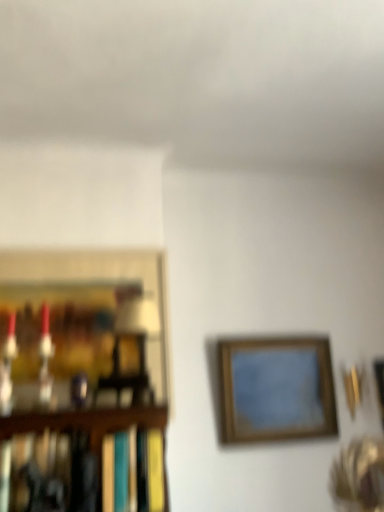
Describe the element at coordinates (81, 374) in the screenshot. I see `wooden picture frame at left, which ranks as the 1th picture frame in left-to-right order` at that location.

The image size is (384, 512). Find the location of `wooden picture frame at left, which is counted as the 3th picture frame, starting from the right`. wooden picture frame at left, which is counted as the 3th picture frame, starting from the right is located at coordinates (81, 374).

Can you confirm if hardcover book at left is taller than wooden picture frame at left, which ranks as the 1th picture frame in left-to-right order?

No, hardcover book at left is not taller than wooden picture frame at left, which ranks as the 1th picture frame in left-to-right order.

Looking at this image, which of these two, hardcover book at left or wooden picture frame at left, which ranks as the 1th picture frame in left-to-right order, is thinner?

wooden picture frame at left, which ranks as the 1th picture frame in left-to-right order, is thinner.

Can wooden picture frame at left, which is counted as the 3th picture frame, starting from the right, be found inside hardcover book at left?

No, hardcover book at left does not contain wooden picture frame at left, which is counted as the 3th picture frame, starting from the right.

Consider the image. Does wooden framed picture at center, which is the second picture frame from right to left, turn towards wooden frame at upper right, the first picture frame when ordered from right to left?

No, wooden framed picture at center, which is the second picture frame from right to left, is not turned towards wooden frame at upper right, the first picture frame when ordered from right to left.

Can you confirm if wooden framed picture at center, which is the second picture frame from right to left, is bigger than wooden frame at upper right, the first picture frame when ordered from right to left?

Correct, wooden framed picture at center, which is the second picture frame from right to left, is larger in size than wooden frame at upper right, the first picture frame when ordered from right to left.

Between wooden framed picture at center, which is the second picture frame from right to left, and wooden frame at upper right, the third picture frame viewed from the left, which one has more height?

Standing taller between the two is wooden framed picture at center, which is the second picture frame from right to left.

Who is more distant, wooden framed picture at center, which appears as the 2th picture frame when viewed from the left, or wooden frame at upper right, the first picture frame when ordered from right to left?

Positioned behind is wooden frame at upper right, the first picture frame when ordered from right to left.

Does wooden picture frame at left, which ranks as the 1th picture frame in left-to-right order, appear on the left side of hardcover book at left?

Yes, wooden picture frame at left, which ranks as the 1th picture frame in left-to-right order, is to the left of hardcover book at left.

Consider the image. Is wooden picture frame at left, which ranks as the 1th picture frame in left-to-right order, beside hardcover book at left?

wooden picture frame at left, which ranks as the 1th picture frame in left-to-right order, and hardcover book at left are not in contact.

Would you say wooden picture frame at left, which ranks as the 1th picture frame in left-to-right order, is outside hardcover book at left?

Absolutely, wooden picture frame at left, which ranks as the 1th picture frame in left-to-right order, is external to hardcover book at left.

Between point (152, 306) and point (23, 466), which one is positioned behind?

Point (152, 306)

Is hardcover book at left aimed at wooden framed picture at center, which appears as the 2th picture frame when viewed from the left?

No, hardcover book at left does not turn towards wooden framed picture at center, which appears as the 2th picture frame when viewed from the left.

Choose the correct answer: Is hardcover book at left inside wooden framed picture at center, which appears as the 2th picture frame when viewed from the left, or outside it?

hardcover book at left is not inside wooden framed picture at center, which appears as the 2th picture frame when viewed from the left, it's outside.

You are a GUI agent. You are given a task and a screenshot of the screen. Output one action in this format:
    pyautogui.click(x=<x>, y=<y>)
    Task: Click on the 1st picture frame counting from the right of the hardcover book at left
    Image resolution: width=384 pixels, height=512 pixels.
    Given the screenshot: What is the action you would take?
    pyautogui.click(x=276, y=389)

Between wooden frame at upper right, the third picture frame viewed from the left, and wooden picture frame at left, which is counted as the 3th picture frame, starting from the right, which one has less height?

With less height is wooden frame at upper right, the third picture frame viewed from the left.

In the image, is wooden frame at upper right, the first picture frame when ordered from right to left, positioned in front of or behind wooden picture frame at left, which ranks as the 1th picture frame in left-to-right order?

wooden frame at upper right, the first picture frame when ordered from right to left, is positioned farther from the viewer than wooden picture frame at left, which ranks as the 1th picture frame in left-to-right order.

From the picture: Is wooden frame at upper right, the first picture frame when ordered from right to left, taller than wooden framed picture at center, which appears as the 2th picture frame when viewed from the left?

No, wooden frame at upper right, the first picture frame when ordered from right to left, is not taller than wooden framed picture at center, which appears as the 2th picture frame when viewed from the left.

Does wooden frame at upper right, the first picture frame when ordered from right to left, have a smaller size compared to wooden framed picture at center, which appears as the 2th picture frame when viewed from the left?

Indeed, wooden frame at upper right, the first picture frame when ordered from right to left, has a smaller size compared to wooden framed picture at center, which appears as the 2th picture frame when viewed from the left.

From the image's perspective, relative to wooden framed picture at center, which appears as the 2th picture frame when viewed from the left, is wooden frame at upper right, the third picture frame viewed from the left, above or below?

wooden frame at upper right, the third picture frame viewed from the left, is situated lower than wooden framed picture at center, which appears as the 2th picture frame when viewed from the left, in the image.

Considering the positions of objects wooden frame at upper right, the first picture frame when ordered from right to left, and wooden framed picture at center, which is the second picture frame from right to left, in the image provided, who is more to the right, wooden frame at upper right, the first picture frame when ordered from right to left, or wooden framed picture at center, which is the second picture frame from right to left,?

wooden frame at upper right, the first picture frame when ordered from right to left, is more to the right.

How much distance is there between wooden picture frame at left, which ranks as the 1th picture frame in left-to-right order, and wooden frame at upper right, the third picture frame viewed from the left?

wooden picture frame at left, which ranks as the 1th picture frame in left-to-right order, and wooden frame at upper right, the third picture frame viewed from the left, are 1.31 meters apart.

Which object is thinner, wooden picture frame at left, which ranks as the 1th picture frame in left-to-right order, or wooden frame at upper right, the third picture frame viewed from the left?

wooden frame at upper right, the third picture frame viewed from the left, is thinner.

From a real-world perspective, is wooden picture frame at left, which is counted as the 3th picture frame, starting from the right, over wooden frame at upper right, the first picture frame when ordered from right to left?

Yes.

Can you confirm if wooden picture frame at left, which ranks as the 1th picture frame in left-to-right order, is positioned to the left of wooden frame at upper right, the first picture frame when ordered from right to left?

Yes, wooden picture frame at left, which ranks as the 1th picture frame in left-to-right order, is to the left of wooden frame at upper right, the first picture frame when ordered from right to left.

Find the location of a particular element. This screenshot has width=384, height=512. book to the right of wooden picture frame at left, which is counted as the 3th picture frame, starting from the right is located at coordinates [x=48, y=472].

Identify the location of the 1st picture frame above when counting from the wooden frame at upper right, the third picture frame viewed from the left (from the image's perspective). The image size is (384, 512). (276, 389).

Looking at the image, which one is located closer to wooden framed picture at center, which appears as the 2th picture frame when viewed from the left, hardcover book at left or wooden frame at upper right, the third picture frame viewed from the left?

wooden frame at upper right, the third picture frame viewed from the left, lies closer to wooden framed picture at center, which appears as the 2th picture frame when viewed from the left, than the other object.

Based on their spatial positions, is wooden frame at upper right, the third picture frame viewed from the left, or wooden picture frame at left, which ranks as the 1th picture frame in left-to-right order, closer to wooden framed picture at center, which appears as the 2th picture frame when viewed from the left?

Among the two, wooden frame at upper right, the third picture frame viewed from the left, is located nearer to wooden framed picture at center, which appears as the 2th picture frame when viewed from the left.

When comparing their distances from hardcover book at left, does wooden frame at upper right, the third picture frame viewed from the left, or wooden framed picture at center, which is the second picture frame from right to left, seem closer?

wooden framed picture at center, which is the second picture frame from right to left.

In the scene shown: From the image, which object appears to be nearer to wooden frame at upper right, the third picture frame viewed from the left, wooden framed picture at center, which is the second picture frame from right to left, or wooden picture frame at left, which is counted as the 3th picture frame, starting from the right?

Based on the image, wooden framed picture at center, which is the second picture frame from right to left, appears to be nearer to wooden frame at upper right, the third picture frame viewed from the left.

Looking at this image, estimate the real-world distances between objects in this image. Which object is closer to hardcover book at left, wooden framed picture at center, which is the second picture frame from right to left, or wooden picture frame at left, which is counted as the 3th picture frame, starting from the right?

wooden picture frame at left, which is counted as the 3th picture frame, starting from the right, is positioned closer to the anchor hardcover book at left.

Estimate the real-world distances between objects in this image. Which object is further from hardcover book at left, wooden frame at upper right, the third picture frame viewed from the left, or wooden picture frame at left, which ranks as the 1th picture frame in left-to-right order?

wooden frame at upper right, the third picture frame viewed from the left, is further to hardcover book at left.

Looking at the image, which one is located closer to wooden framed picture at center, which is the second picture frame from right to left, wooden frame at upper right, the third picture frame viewed from the left, or hardcover book at left?

wooden frame at upper right, the third picture frame viewed from the left, is positioned closer to the anchor wooden framed picture at center, which is the second picture frame from right to left.

Looking at the image, which one is located closer to wooden frame at upper right, the first picture frame when ordered from right to left, wooden picture frame at left, which ranks as the 1th picture frame in left-to-right order, or wooden framed picture at center, which appears as the 2th picture frame when viewed from the left?

wooden framed picture at center, which appears as the 2th picture frame when viewed from the left, is closer to wooden frame at upper right, the first picture frame when ordered from right to left.

Where is `picture frame situated between hardcover book at left and wooden frame at upper right, the third picture frame viewed from the left, from left to right`? This screenshot has width=384, height=512. picture frame situated between hardcover book at left and wooden frame at upper right, the third picture frame viewed from the left, from left to right is located at coordinates (276, 389).

At what (x,y) coordinates should I click in order to perform the action: click on book situated between wooden picture frame at left, which is counted as the 3th picture frame, starting from the right, and wooden framed picture at center, which appears as the 2th picture frame when viewed from the left, from left to right. Please return your answer as a coordinate pair (x, y). Looking at the image, I should click on (48, 472).

Find the location of `book between wooden picture frame at left, which is counted as the 3th picture frame, starting from the right, and wooden frame at upper right, the first picture frame when ordered from right to left, from left to right`. book between wooden picture frame at left, which is counted as the 3th picture frame, starting from the right, and wooden frame at upper right, the first picture frame when ordered from right to left, from left to right is located at coordinates (48, 472).

Image resolution: width=384 pixels, height=512 pixels. Identify the location of picture frame between wooden picture frame at left, which is counted as the 3th picture frame, starting from the right, and wooden frame at upper right, the third picture frame viewed from the left, in the horizontal direction. (276, 389).